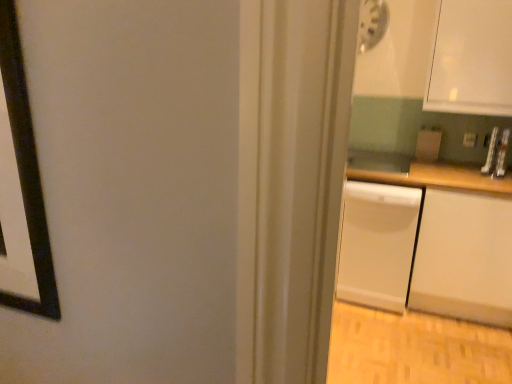
Question: Is white matte counter at right next to matte white dishwasher at right?

Choices:
 (A) yes
 (B) no

Answer: (B)

Question: Is white matte counter at right closer to the viewer compared to matte white dishwasher at right?

Choices:
 (A) yes
 (B) no

Answer: (A)

Question: From a real-world perspective, is white matte counter at right beneath matte white dishwasher at right?

Choices:
 (A) yes
 (B) no

Answer: (A)

Question: Is white matte counter at right not within matte white dishwasher at right?

Choices:
 (A) yes
 (B) no

Answer: (A)

Question: Does white matte counter at right come behind matte white dishwasher at right?

Choices:
 (A) yes
 (B) no

Answer: (B)

Question: Is matte white dishwasher at right wider or thinner than white matte dishwasher at right?

Choices:
 (A) thin
 (B) wide

Answer: (A)

Question: Visually, is matte white dishwasher at right positioned to the left or to the right of white matte dishwasher at right?

Choices:
 (A) right
 (B) left

Answer: (A)

Question: From a real-world perspective, is matte white dishwasher at right physically located above or below white matte dishwasher at right?

Choices:
 (A) above
 (B) below

Answer: (A)

Question: From the image's perspective, is matte white dishwasher at right located above or below white matte dishwasher at right?

Choices:
 (A) below
 (B) above

Answer: (B)

Question: Considering the positions of white matte dishwasher at right and white matte counter at right in the image, is white matte dishwasher at right taller or shorter than white matte counter at right?

Choices:
 (A) short
 (B) tall

Answer: (A)

Question: From the image's perspective, is white matte dishwasher at right positioned above or below white matte counter at right?

Choices:
 (A) above
 (B) below

Answer: (B)

Question: Is point (408, 241) positioned closer to the camera than point (429, 309)?

Choices:
 (A) farther
 (B) closer

Answer: (B)

Question: Is white matte dishwasher at right bigger or smaller than white matte counter at right?

Choices:
 (A) small
 (B) big

Answer: (A)

Question: Is white matte counter at right in front of or behind matte white dishwasher at right in the image?

Choices:
 (A) front
 (B) behind

Answer: (A)

Question: Would you say white matte counter at right is to the left or to the right of matte white dishwasher at right in the picture?

Choices:
 (A) right
 (B) left

Answer: (B)